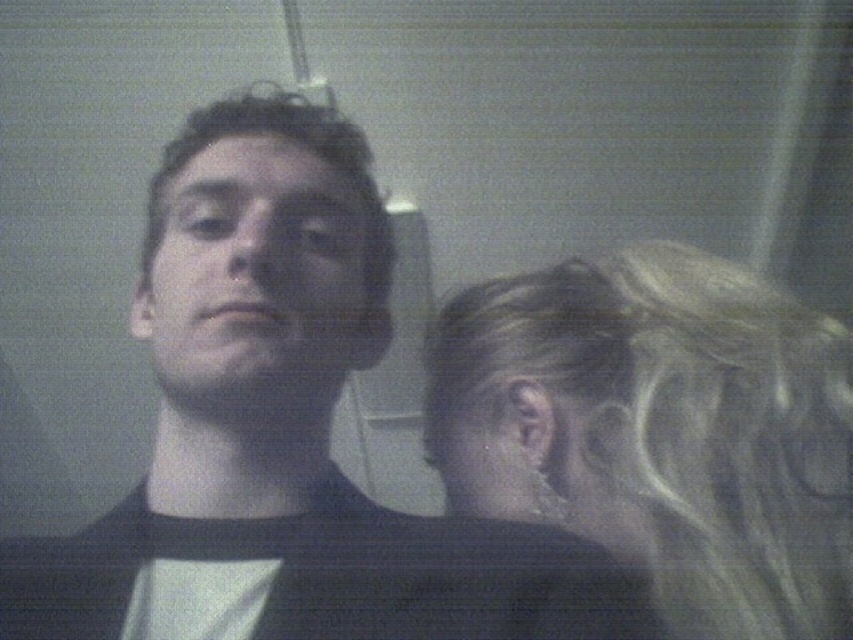
Question: Can you confirm if blonde hair at right is positioned to the right of matte black face at center?

Choices:
 (A) no
 (B) yes

Answer: (B)

Question: Is blonde hair at right wider than matte black face at center?

Choices:
 (A) no
 (B) yes

Answer: (B)

Question: Is black matte shirt at center positioned behind blonde hair at right?

Choices:
 (A) no
 (B) yes

Answer: (A)

Question: Which of the following is the closest to the observer?

Choices:
 (A) blonde hair at right
 (B) black matte shirt at center

Answer: (B)

Question: Among these points, which one is nearest to the camera?

Choices:
 (A) (790, 506)
 (B) (222, 268)

Answer: (B)

Question: Estimate the real-world distances between objects in this image. Which object is farther from the blonde hair at right?

Choices:
 (A) matte black face at center
 (B) black matte shirt at center

Answer: (A)